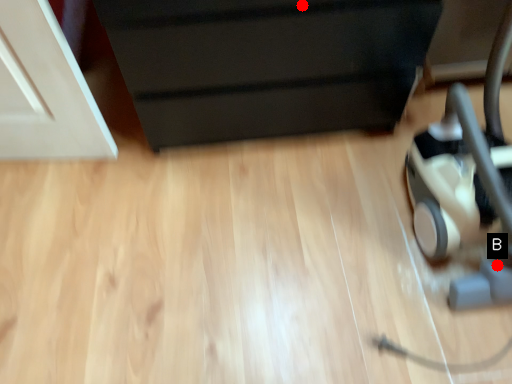
Question: Two points are circled on the image, labeled by A and B beside each circle. Which of the following is the closest to the observer?

Choices:
 (A) A is closer
 (B) B is closer

Answer: (A)